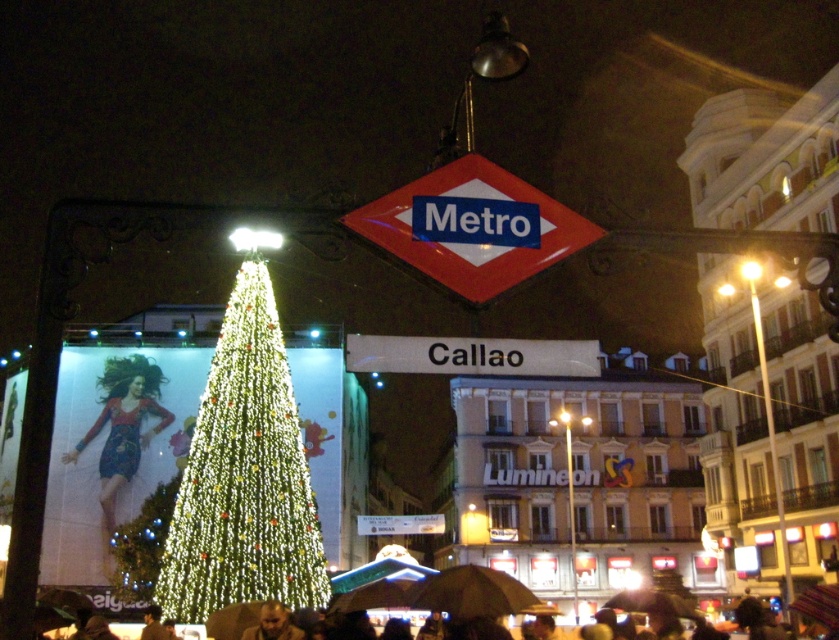
Between dark brown leather umbrella at lower center and smooth skin face at lower center, which one is positioned lower?

dark brown leather umbrella at lower center

Identify the location of dark brown leather umbrella at lower center. (819, 605).

Find the location of `dark brown leather umbrella at lower center`. dark brown leather umbrella at lower center is located at coordinates 819,605.

Can you confirm if white plastic sign at center is smaller than smooth skin face at lower center?

Actually, white plastic sign at center might be larger than smooth skin face at lower center.

Is white plastic sign at center to the left of smooth skin face at lower center from the viewer's perspective?

In fact, white plastic sign at center is to the right of smooth skin face at lower center.

This screenshot has width=839, height=640. What are the coordinates of `white plastic sign at center` in the screenshot? It's located at (472, 355).

Identify the location of white plastic sign at center. (472, 355).

Can you confirm if metallic diamond-shaped sign at center is positioned above smooth skin face at lower center?

→ Indeed, metallic diamond-shaped sign at center is positioned over smooth skin face at lower center.

The height and width of the screenshot is (640, 839). I want to click on metallic diamond-shaped sign at center, so click(472, 227).